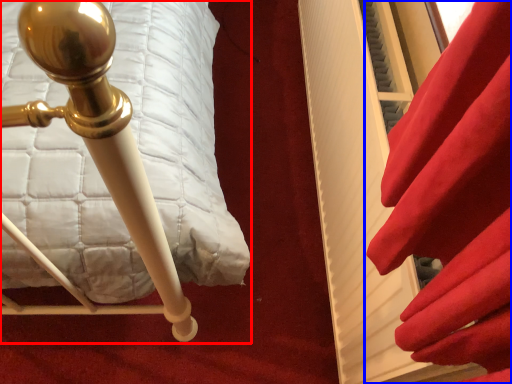
Question: Which object is further to the camera taking this photo, furniture (highlighted by a red box) or curtain (highlighted by a blue box)?

Choices:
 (A) furniture
 (B) curtain

Answer: (A)